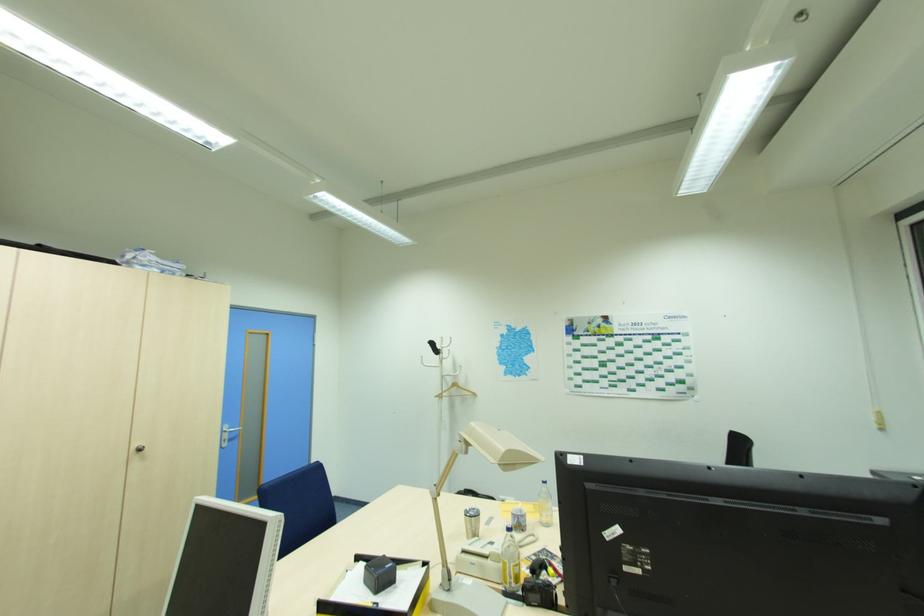
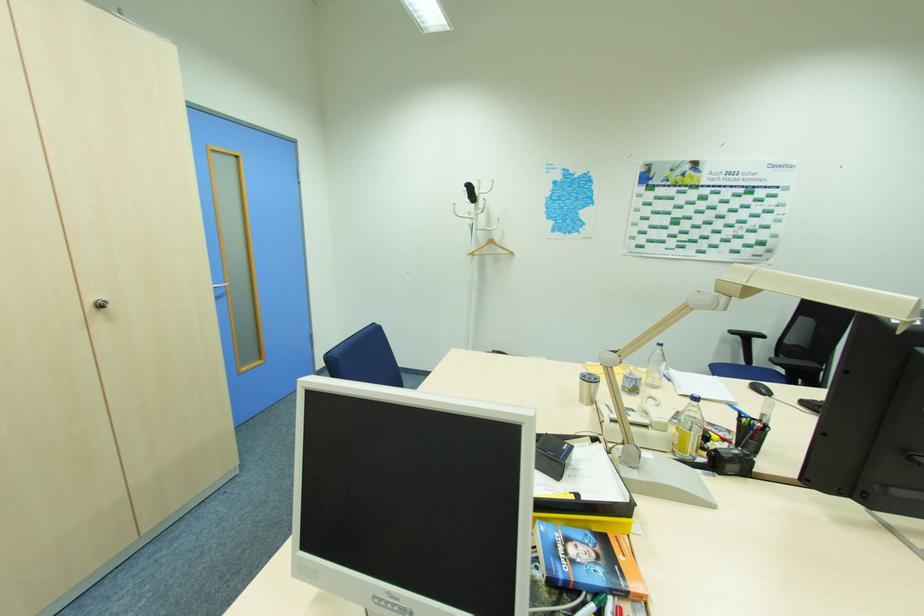
Where in the second image is the point corresponding to [140,450] from the first image?

(103, 306)